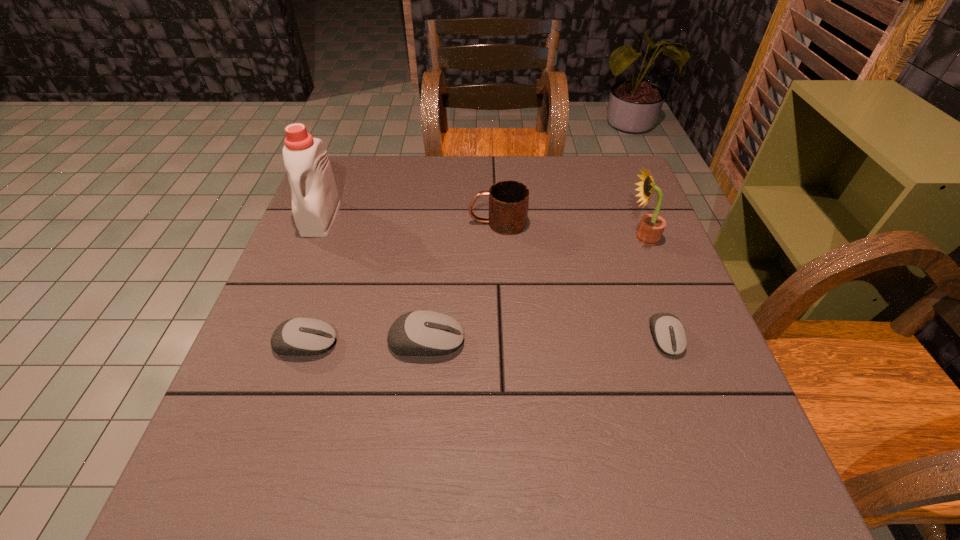
The height and width of the screenshot is (540, 960). Find the location of `vacant space that is in between the third shortest object and the tallest object`. vacant space that is in between the third shortest object and the tallest object is located at coordinates (373, 280).

Find the location of `free point between the shortest object and the third tallest object`. free point between the shortest object and the third tallest object is located at coordinates (581, 280).

This screenshot has width=960, height=540. I want to click on object that ranks as the fourth closest to the third object from left to right, so click(x=669, y=334).

Select which object is the fifth closest to the fourth object from left to right. Please provide its 2D coordinates. Your answer should be formatted as a tuple, i.e. [(x, y)], where the tuple contains the x and y coordinates of a point satisfying the conditions above.

[(303, 336)]

Identify which computer equipment is located as the nearest to the sunflower. Please provide its 2D coordinates. Your answer should be formatted as a tuple, i.e. [(x, y)], where the tuple contains the x and y coordinates of a point satisfying the conditions above.

[(669, 334)]

The width and height of the screenshot is (960, 540). In order to click on computer equipment that stands as the second closest to the leftmost computer equipment in this screenshot , I will do `click(669, 334)`.

Identify the location of free space that satisfies the following two spatial constraints: 1. on the wheel side of the shortest computer equipment; 2. on the wheel side of the tallest computer equipment. (666, 341).

The height and width of the screenshot is (540, 960). In order to click on vacant space that satisfies the following two spatial constraints: 1. on the wheel side of the rightmost computer equipment; 2. on the wheel side of the second shortest computer equipment in this screenshot , I will do `click(667, 343)`.